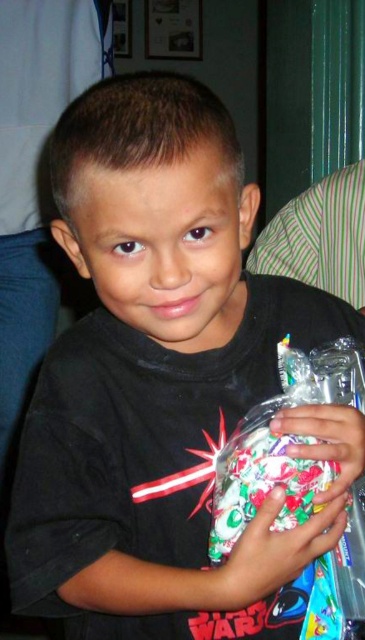
Between point (296, 525) and point (346, 440), which one is positioned in front?

Positioned in front is point (296, 525).

The height and width of the screenshot is (640, 365). Identify the location of shiny plastic bag of candies at center. (262, 483).

Between shiny plastic bag of candies at center and floral fabric wrapped gift at center, which one appears on the right side from the viewer's perspective?

From the viewer's perspective, floral fabric wrapped gift at center appears more on the right side.

The image size is (365, 640). Describe the element at coordinates (262, 483) in the screenshot. I see `shiny plastic bag of candies at center` at that location.

Find the location of a particular element. The width and height of the screenshot is (365, 640). shiny plastic bag of candies at center is located at coordinates (262, 483).

In the scene shown: Is floral fabric wrapped gift at center positioned at the back of translucent plastic jar at center?

No.

Measure the distance between floral fabric wrapped gift at center and translucent plastic jar at center.

They are 2.15 inches apart.

Who is more distant from viewer, (344,516) or (304,428)?

Positioned behind is point (344,516).

Where is `floral fabric wrapped gift at center`? This screenshot has width=365, height=640. floral fabric wrapped gift at center is located at coordinates (275, 550).